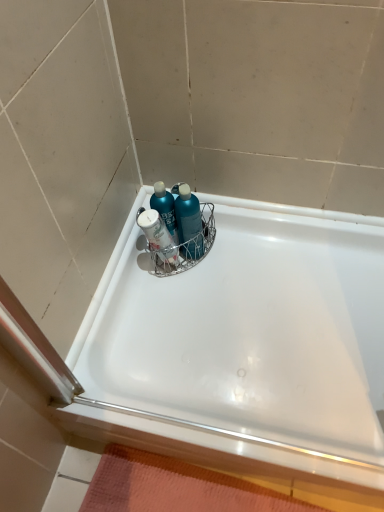
Find the location of a particular element. Image resolution: width=384 pixels, height=512 pixels. unoccupied area in front of teal plastic bottles at center, placed as the 1th cleaning product when sorted from right to left is located at coordinates (205, 289).